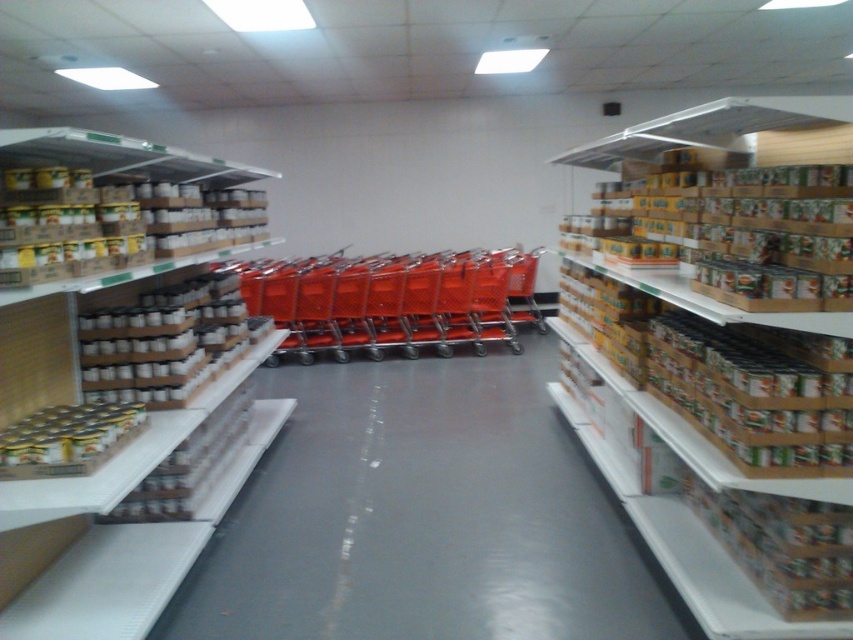
Question: Among these objects, which one is nearest to the camera?

Choices:
 (A) brown cardboard boxes at right
 (B) white cardboard boxes at left

Answer: (A)

Question: Which object is the closest to the white cardboard boxes at left?

Choices:
 (A) brown cardboard boxes at right
 (B) metallic orange shopping cart at center
 (C) matte cardboard boxes at left

Answer: (A)

Question: Is white cardboard boxes at left above matte cardboard boxes at left?

Choices:
 (A) no
 (B) yes

Answer: (A)

Question: Does brown cardboard boxes at right appear under white cardboard boxes at left?

Choices:
 (A) yes
 (B) no

Answer: (B)

Question: Considering the relative positions of brown cardboard boxes at right and white cardboard boxes at left in the image provided, where is brown cardboard boxes at right located with respect to white cardboard boxes at left?

Choices:
 (A) right
 (B) left

Answer: (A)

Question: Which point is farther to the camera?

Choices:
 (A) metallic orange shopping cart at center
 (B) matte cardboard boxes at left

Answer: (A)